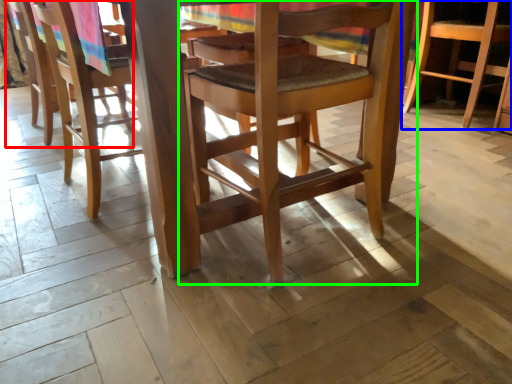
Question: Estimate the real-world distances between objects in this image. Which object is farther from chair (highlighted by a red box), chair (highlighted by a blue box) or chair (highlighted by a green box)?

Choices:
 (A) chair
 (B) chair

Answer: (A)